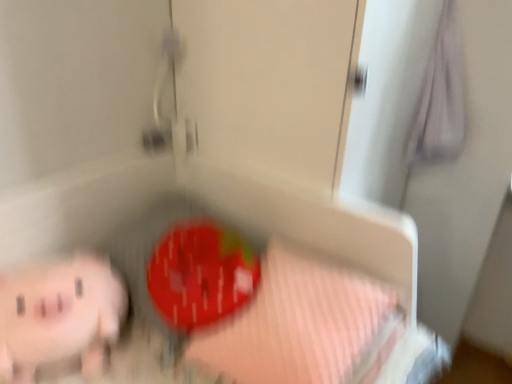
The width and height of the screenshot is (512, 384). I want to click on free space above pink rubber piggy bank at lower left (from a real-world perspective), so (x=42, y=273).